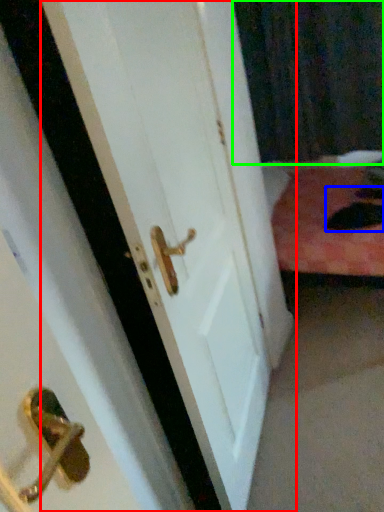
Question: Considering the real-world distances, which object is farthest from door (highlighted by a red box)? cat (highlighted by a blue box) or curtain (highlighted by a green box)?

Choices:
 (A) cat
 (B) curtain

Answer: (B)